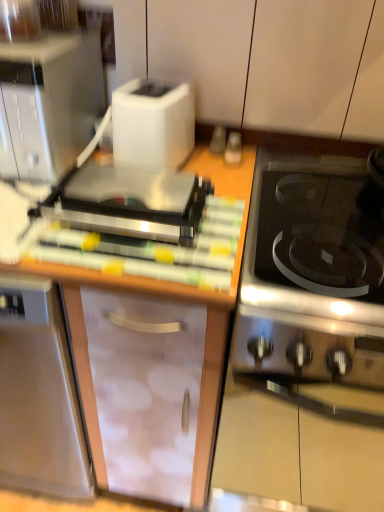
Image resolution: width=384 pixels, height=512 pixels. I want to click on free space above white plastic toaster at upper center (from a real-world perspective), so click(x=157, y=88).